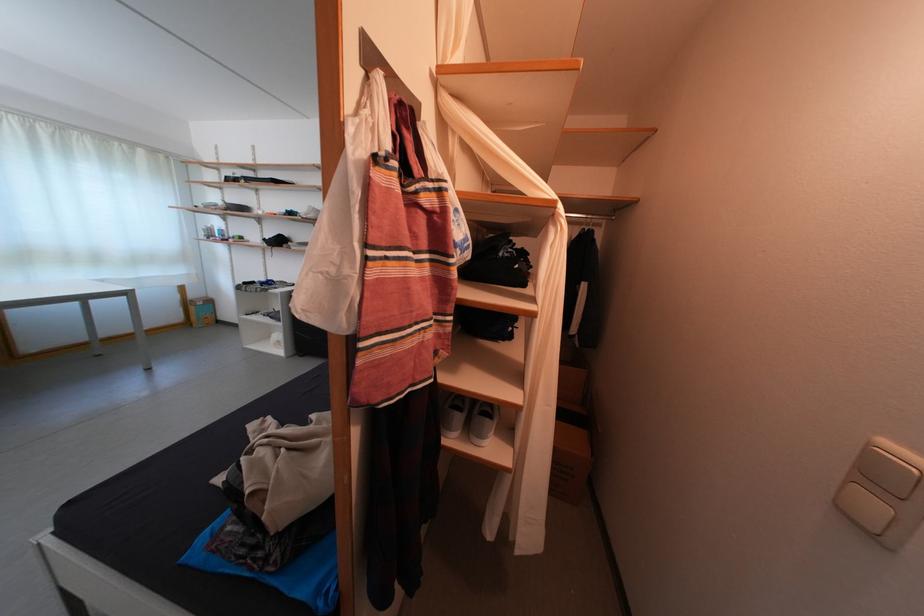
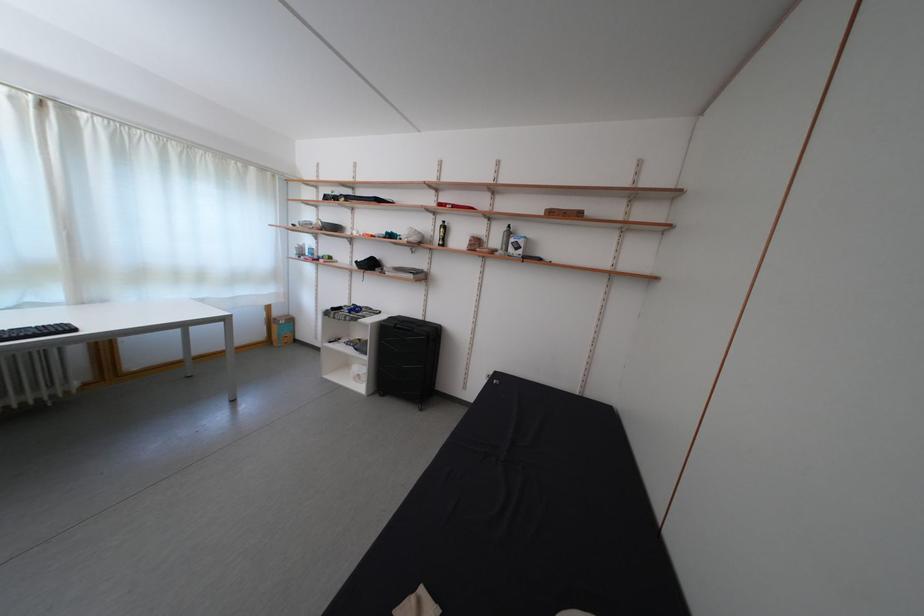
Where in the second image is the point corresponding to (201,302) from the first image?

(285, 320)